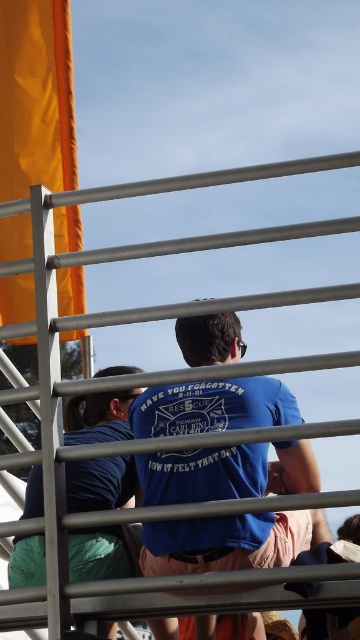
Question: Which object appears closest to the camera in this image?

Choices:
 (A) matte blue t-shirt at center
 (B) blue cotton t-shirt at center

Answer: (B)

Question: Does blue cotton t-shirt at center lie in front of matte blue t-shirt at center?

Choices:
 (A) no
 (B) yes

Answer: (B)

Question: Which point appears closest to the camera in this image?

Choices:
 (A) (293, 456)
 (B) (141, 499)

Answer: (A)

Question: Is blue cotton t-shirt at center positioned behind matte blue t-shirt at center?

Choices:
 (A) yes
 (B) no

Answer: (B)

Question: Which point appears farthest from the camera in this image?

Choices:
 (A) [x=122, y=548]
 (B) [x=279, y=468]

Answer: (B)

Question: Is blue cotton t-shirt at center behind matte blue t-shirt at center?

Choices:
 (A) yes
 (B) no

Answer: (B)